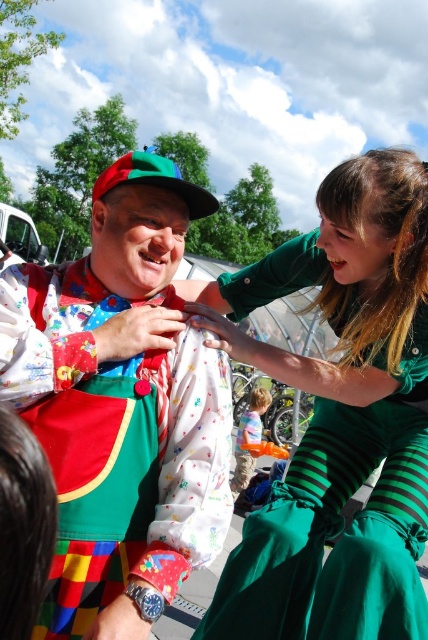
Question: Is floral fabric clown outfit at center closer to the viewer compared to green striped dress at center?

Choices:
 (A) yes
 (B) no

Answer: (A)

Question: Is floral fabric clown outfit at center further to camera compared to green striped dress at center?

Choices:
 (A) no
 (B) yes

Answer: (A)

Question: Which of the following is the closest to the observer?

Choices:
 (A) click(356, 323)
 (B) click(44, 401)

Answer: (B)

Question: Which point is farther from the camera taking this photo?

Choices:
 (A) (255, 516)
 (B) (8, 307)

Answer: (A)

Question: Does floral fabric clown outfit at center have a smaller size compared to green striped dress at center?

Choices:
 (A) yes
 (B) no

Answer: (A)